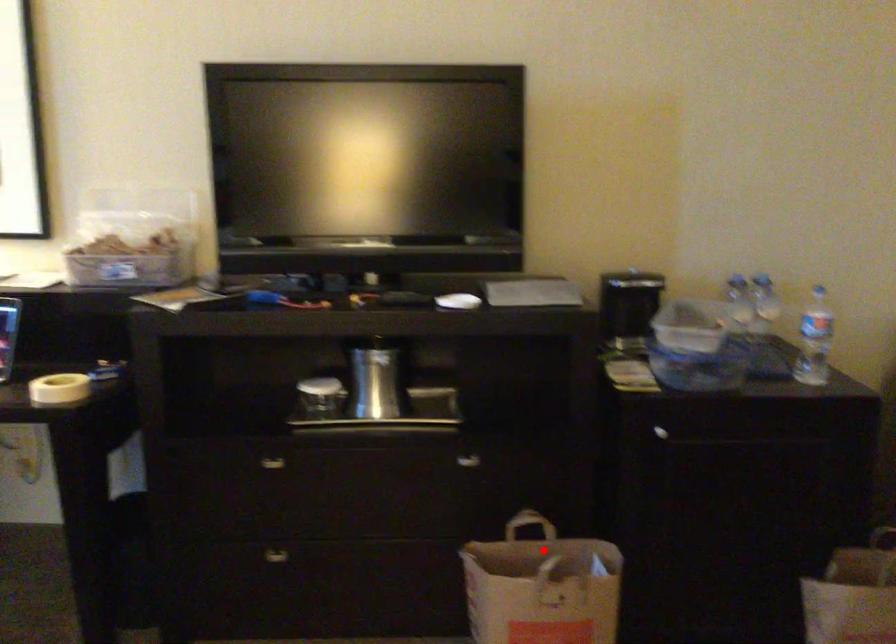
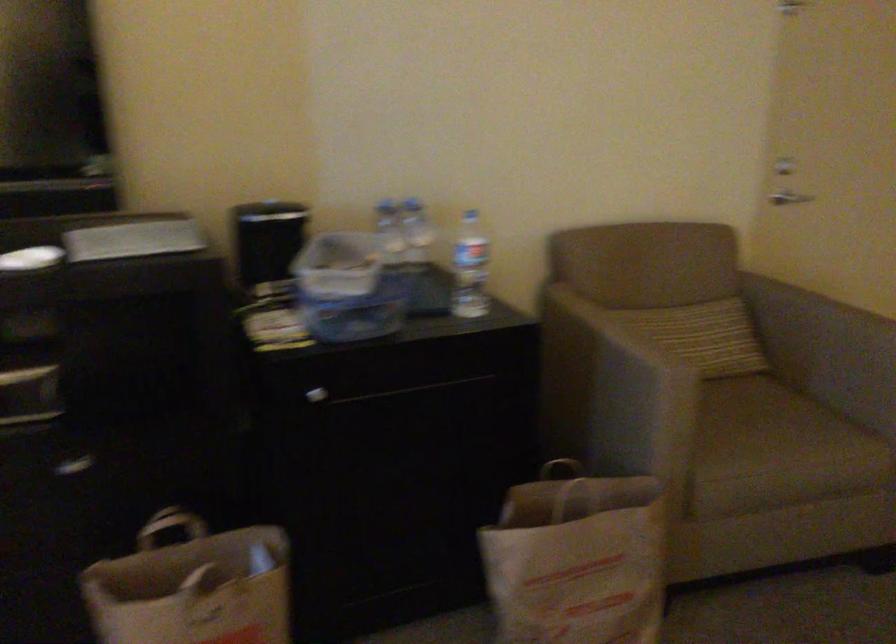
In the second image, find the point that corresponds to the highlighted location in the first image.

(192, 554)